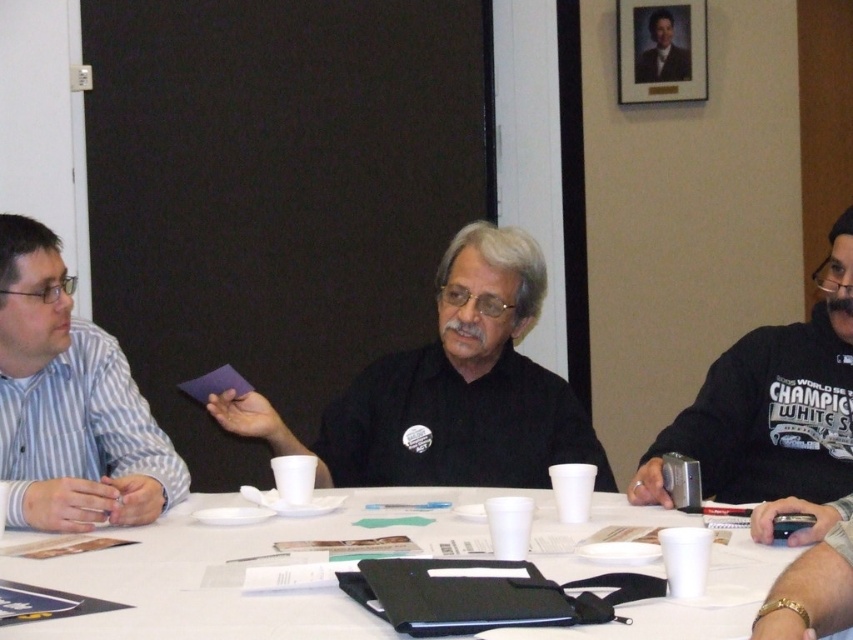
What do you see at coordinates (257, 556) in the screenshot? This screenshot has height=640, width=853. I see `white paper table at center` at bounding box center [257, 556].

Who is shorter, white paper table at center or black matte shirt at center?

With less height is white paper table at center.

I want to click on white paper table at center, so click(x=257, y=556).

Can you confirm if black matte shirt at center is thinner than striped cotton shirt at left?

No.

Between point (579, 412) and point (112, 349), which one is positioned behind?

Positioned behind is point (579, 412).

At what (x,y) coordinates should I click in order to perform the action: click on black matte shirt at center. Please return your answer as a coordinate pair (x, y). Looking at the image, I should click on (450, 388).

Who is lower down, striped cotton shirt at left or black jersey at right?

black jersey at right

Who is higher up, striped cotton shirt at left or black jersey at right?

striped cotton shirt at left is higher up.

Image resolution: width=853 pixels, height=640 pixels. Describe the element at coordinates (70, 403) in the screenshot. I see `striped cotton shirt at left` at that location.

Where is `striped cotton shirt at left`? The width and height of the screenshot is (853, 640). striped cotton shirt at left is located at coordinates (70, 403).